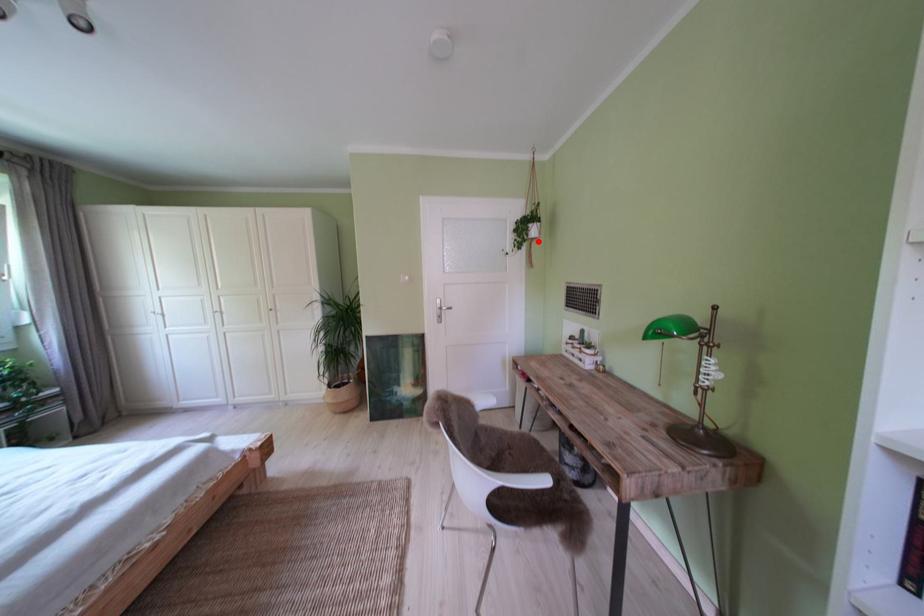
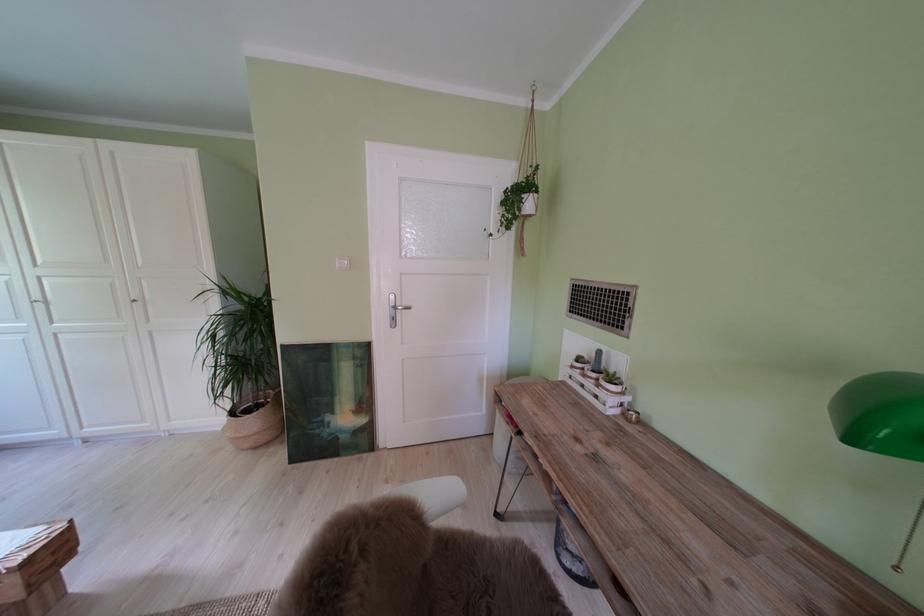
Locate, in the second image, the point that corresponds to the highlighted location in the first image.

(530, 215)